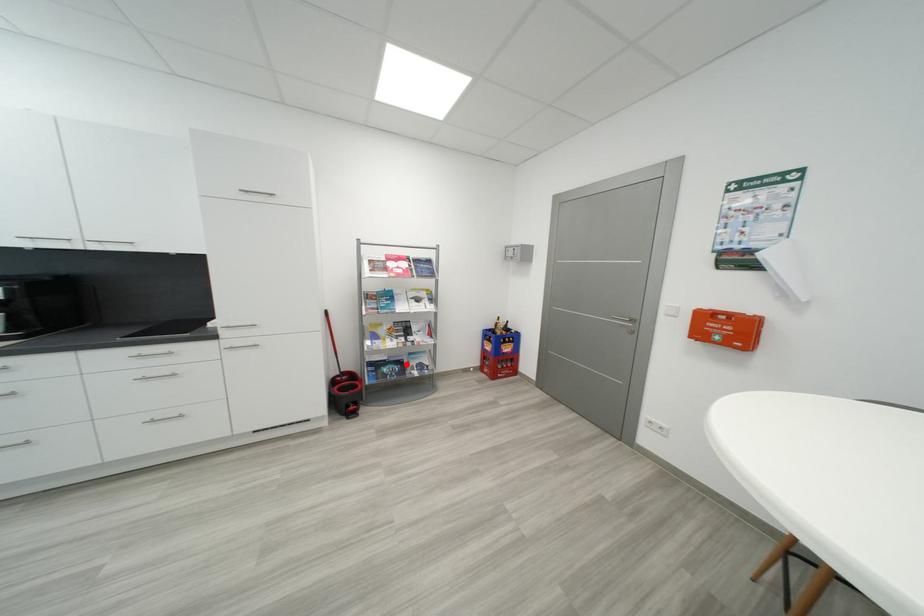
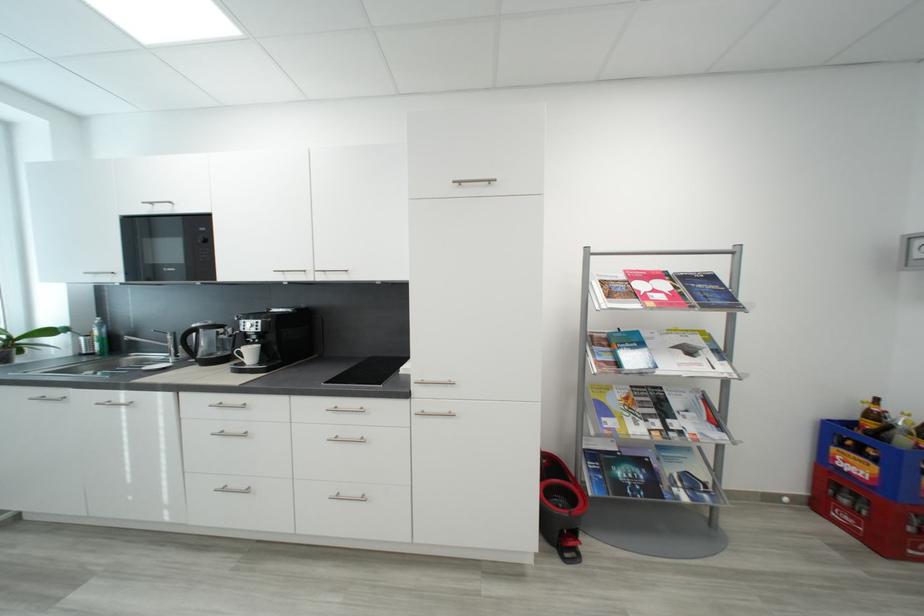
Where in the second image is the point corresponding to the highlighted location from the first image?

(650, 464)